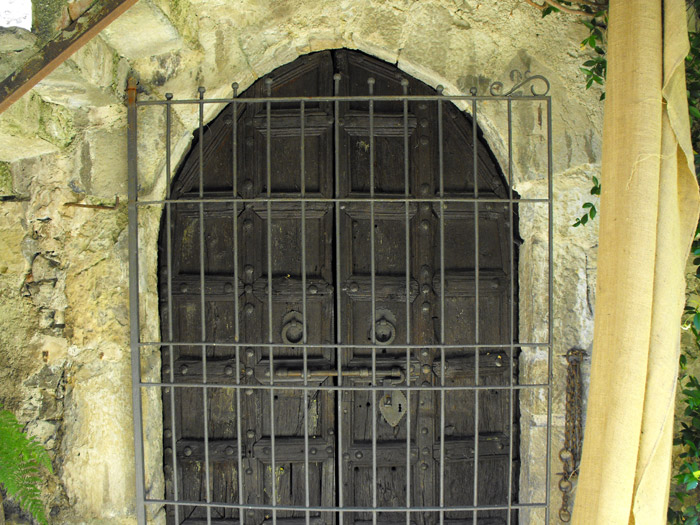
Identify the location of metal bars over the door, perhaps a secondary door that is occasionally unlocked, but it appears locked in this image in effort of keeping guests out. (131, 206).